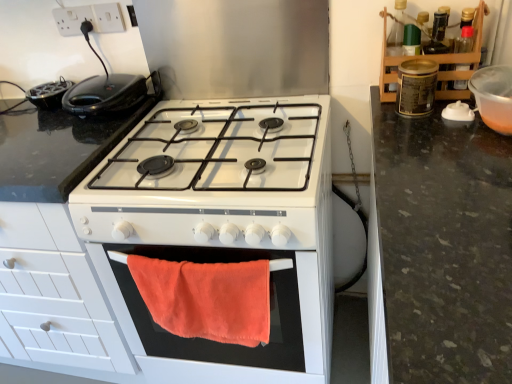
Locate an element on the screen. black plastic toaster at upper left, marked as the 1th appliance in a left-to-right arrangement is located at coordinates (49, 94).

Considering the relative positions of orange fabric towel at center and metallic canister at upper right, acting as the 3th appliance starting from the left, in the image provided, is orange fabric towel at center to the right of metallic canister at upper right, acting as the 3th appliance starting from the left, from the viewer's perspective?

No.

Is point (278, 329) closer to viewer compared to point (434, 97)?

Yes.

From a real-world perspective, is orange fabric towel at center below metallic canister at upper right, which is the 2th appliance from right to left?

Yes, from a real-world perspective, orange fabric towel at center is under metallic canister at upper right, which is the 2th appliance from right to left.

Is orange fabric towel at center taller than metallic canister at upper right, which is the 2th appliance from right to left?

Yes, orange fabric towel at center is taller than metallic canister at upper right, which is the 2th appliance from right to left.

Which of these two, white plastic socket at upper left, which is the first electric outlet from left to right, or black plastic sandwich maker at upper left, is bigger?

With larger size is black plastic sandwich maker at upper left.

Is black plastic sandwich maker at upper left completely or partially inside white plastic socket at upper left, arranged as the 2th electric outlet when viewed from the right?

No, black plastic sandwich maker at upper left is not a part of white plastic socket at upper left, arranged as the 2th electric outlet when viewed from the right.

Considering the positions of objects white plastic socket at upper left, which is the first electric outlet from left to right, and black plastic sandwich maker at upper left in the image provided, who is in front, white plastic socket at upper left, which is the first electric outlet from left to right, or black plastic sandwich maker at upper left?

black plastic sandwich maker at upper left.

Are transparent plastic bowl at upper right, which is counted as the 4th appliance, starting from the left, and white glossy stove at center, the 2th appliance positioned from the left, making contact?

transparent plastic bowl at upper right, which is counted as the 4th appliance, starting from the left, and white glossy stove at center, the 2th appliance positioned from the left, are clearly separated.

Is transparent plastic bowl at upper right, which is counted as the 4th appliance, starting from the left, to the left or to the right of white glossy stove at center, the third appliance when ordered from right to left, in the image?

Based on their positions, transparent plastic bowl at upper right, which is counted as the 4th appliance, starting from the left, is located to the right of white glossy stove at center, the third appliance when ordered from right to left.

Based on the photo, can you confirm if transparent plastic bowl at upper right, which is counted as the 4th appliance, starting from the left, is taller than white glossy stove at center, the third appliance when ordered from right to left?

In fact, transparent plastic bowl at upper right, which is counted as the 4th appliance, starting from the left, may be shorter than white glossy stove at center, the third appliance when ordered from right to left.

Who is smaller, white glossy gas stove at center or white glossy stove at center, the third appliance when ordered from right to left?

Smaller between the two is white glossy gas stove at center.

From a real-world perspective, relative to white glossy stove at center, the 2th appliance positioned from the left, is white glossy gas stove at center vertically above or below?

Clearly, from a real-world perspective, white glossy gas stove at center is above white glossy stove at center, the 2th appliance positioned from the left.

Is point (162, 189) positioned after point (104, 208)?

That is True.

The width and height of the screenshot is (512, 384). Find the location of `appliance that is the 1st object to the right of the white glossy gas stove at center, starting at the anchor`. appliance that is the 1st object to the right of the white glossy gas stove at center, starting at the anchor is located at coordinates (221, 227).

Which point is more distant from viewer, (190, 146) or (110, 20)?

Positioned behind is point (110, 20).

Considering the sizes of white glossy gas stove at center and white plastic socket at upper left, which appears as the first electric outlet when viewed from the right, in the image, is white glossy gas stove at center bigger or smaller than white plastic socket at upper left, which appears as the first electric outlet when viewed from the right,?

Clearly, white glossy gas stove at center is larger in size than white plastic socket at upper left, which appears as the first electric outlet when viewed from the right.

Is white glossy gas stove at center positioned far away from white plastic socket at upper left, placed as the second electric outlet when sorted from left to right?

white glossy gas stove at center is actually quite close to white plastic socket at upper left, placed as the second electric outlet when sorted from left to right.

Is point (113, 20) positioned before point (80, 7)?

That is False.

Considering the sizes of white plastic socket at upper left, which appears as the first electric outlet when viewed from the right, and white plastic socket at upper left, arranged as the 2th electric outlet when viewed from the right, in the image, is white plastic socket at upper left, which appears as the first electric outlet when viewed from the right, wider or thinner than white plastic socket at upper left, arranged as the 2th electric outlet when viewed from the right,?

Considering their sizes, white plastic socket at upper left, which appears as the first electric outlet when viewed from the right, looks broader than white plastic socket at upper left, arranged as the 2th electric outlet when viewed from the right.

Is point (109, 22) behind point (33, 91)?

No, (109, 22) is in front of (33, 91).

Can you confirm if white plastic socket at upper left, placed as the second electric outlet when sorted from left to right, is shorter than black plastic toaster at upper left, the 4th appliance when ordered from right to left?

In fact, white plastic socket at upper left, placed as the second electric outlet when sorted from left to right, may be taller than black plastic toaster at upper left, the 4th appliance when ordered from right to left.

From the image's perspective, is white plastic socket at upper left, placed as the second electric outlet when sorted from left to right, on top of black plastic toaster at upper left, the 4th appliance when ordered from right to left?

Yes.

The height and width of the screenshot is (384, 512). Identify the location of the 3rd appliance above the orange fabric towel at center (from a real-world perspective). (416, 87).

The width and height of the screenshot is (512, 384). I want to click on the 1st electric outlet above when counting from the black plastic sandwich maker at upper left (from the image's perspective), so click(73, 19).

From the image, which object appears to be farther from black plastic toaster at upper left, marked as the 1th appliance in a left-to-right arrangement, black plastic sandwich maker at upper left or white plastic socket at upper left, which appears as the first electric outlet when viewed from the right?

white plastic socket at upper left, which appears as the first electric outlet when viewed from the right.

Which object lies nearer to the anchor point transparent plastic bowl at upper right, placed as the 1th appliance when sorted from right to left, white plastic socket at upper left, placed as the second electric outlet when sorted from left to right, or black plastic sandwich maker at upper left?

black plastic sandwich maker at upper left is closer to transparent plastic bowl at upper right, placed as the 1th appliance when sorted from right to left.

Which object lies further to the anchor point black plastic toaster at upper left, the 4th appliance when ordered from right to left, metallic canister at upper right, acting as the 3th appliance starting from the left, or transparent plastic bowl at upper right, which is counted as the 4th appliance, starting from the left?

Based on the image, transparent plastic bowl at upper right, which is counted as the 4th appliance, starting from the left, appears to be further to black plastic toaster at upper left, the 4th appliance when ordered from right to left.

Estimate the real-world distances between objects in this image. Which object is further from black plastic toaster at upper left, marked as the 1th appliance in a left-to-right arrangement, transparent plastic bowl at upper right, placed as the 1th appliance when sorted from right to left, or orange fabric towel at center?

transparent plastic bowl at upper right, placed as the 1th appliance when sorted from right to left, lies further to black plastic toaster at upper left, marked as the 1th appliance in a left-to-right arrangement, than the other object.

Looking at the image, which one is located further to white glossy stove at center, the 2th appliance positioned from the left, orange fabric towel at center or black plastic sandwich maker at upper left?

black plastic sandwich maker at upper left.

When comparing their distances from black plastic sandwich maker at upper left, does orange fabric towel at center or white plastic socket at upper left, which appears as the first electric outlet when viewed from the right, seem closer?

white plastic socket at upper left, which appears as the first electric outlet when viewed from the right.

Looking at the image, which one is located further to white glossy gas stove at center, metallic canister at upper right, acting as the 3th appliance starting from the left, or white plastic socket at upper left, arranged as the 2th electric outlet when viewed from the right?

The object further to white glossy gas stove at center is white plastic socket at upper left, arranged as the 2th electric outlet when viewed from the right.

Considering their positions, is white plastic socket at upper left, which appears as the first electric outlet when viewed from the right, positioned closer to black plastic toaster at upper left, the 4th appliance when ordered from right to left, than metallic canister at upper right, acting as the 3th appliance starting from the left?

white plastic socket at upper left, which appears as the first electric outlet when viewed from the right.

Locate an element on the screen. The height and width of the screenshot is (384, 512). gas stove situated between black plastic sandwich maker at upper left and metallic canister at upper right, acting as the 3th appliance starting from the left, from left to right is located at coordinates (217, 149).

Find the location of a particular element. kitchen appliance located between black plastic toaster at upper left, the 4th appliance when ordered from right to left, and transparent plastic bowl at upper right, placed as the 1th appliance when sorted from right to left, in the left-right direction is located at coordinates 104,94.

This screenshot has width=512, height=384. I want to click on gas stove between white plastic socket at upper left, which is the first electric outlet from left to right, and white glossy stove at center, the third appliance when ordered from right to left, vertically, so click(217, 149).

Identify the location of appliance that lies between white plastic socket at upper left, arranged as the 2th electric outlet when viewed from the right, and black plastic sandwich maker at upper left from top to bottom. This screenshot has height=384, width=512. (49, 94).